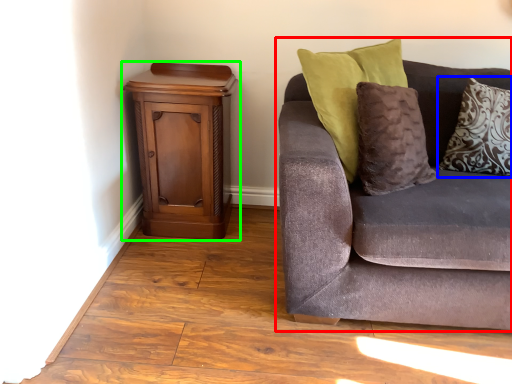
Question: Considering the real-world distances, which object is closest to studio couch (highlighted by a red box)? pillow (highlighted by a blue box) or nightstand (highlighted by a green box).

Choices:
 (A) pillow
 (B) nightstand

Answer: (A)